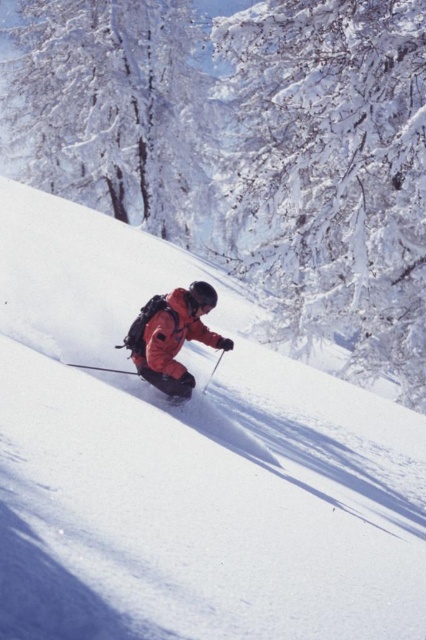
Question: Observing the image, what is the correct spatial positioning of matte orange ski slope at center in reference to snow-covered branches at upper center?

Choices:
 (A) below
 (B) above

Answer: (A)

Question: Which point is farther to the camera?

Choices:
 (A) matte orange ski slope at center
 (B) metallic silver ski pole at center
 (C) white frosty tree at upper left

Answer: (C)

Question: Which of the following is the farthest from the observer?

Choices:
 (A) (189, 532)
 (B) (210, 131)
 (C) (218, 356)
 (D) (138, 323)

Answer: (B)

Question: Is matte orange ski slope at center to the left of metallic silver ski pole at center from the viewer's perspective?

Choices:
 (A) no
 (B) yes

Answer: (B)

Question: Based on their relative distances, which object is nearer to the orange softshell jacket at center?

Choices:
 (A) snow-covered branches at upper center
 (B) metallic silver ski pole at center
 (C) white frosty tree at upper left
 (D) matte orange ski slope at center

Answer: (B)

Question: Can you confirm if snow-covered branches at upper center is wider than white frosty tree at upper left?

Choices:
 (A) no
 (B) yes

Answer: (A)